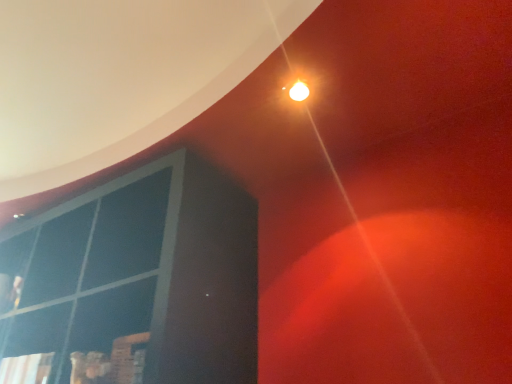
Where is `matte white light bulb at upper center`? The height and width of the screenshot is (384, 512). matte white light bulb at upper center is located at coordinates (298, 91).

What do you see at coordinates (298, 91) in the screenshot? I see `matte white light bulb at upper center` at bounding box center [298, 91].

Measure the distance between matte white light bulb at upper center and camera.

1.17 meters.

Identify the location of matte white light bulb at upper center. The image size is (512, 384). (298, 91).